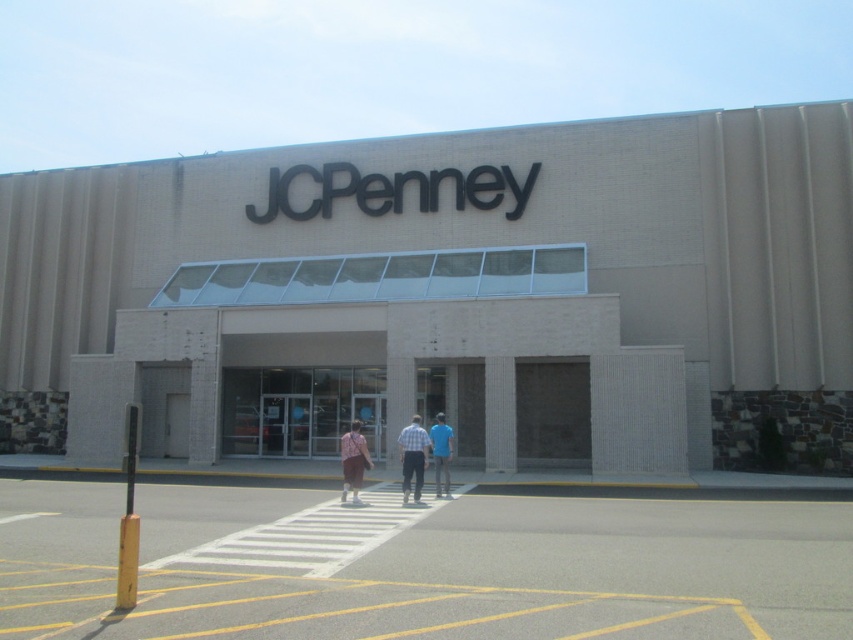
Does white brick storefront at center have a larger size compared to blue cotton shirt at center?

Yes.

Identify the location of white brick storefront at center. (393, 348).

Find the location of a particular element. white brick storefront at center is located at coordinates (393, 348).

Which is behind, point (656, 364) or point (419, 420)?

The point (656, 364) is behind.

Where is `white brick storefront at center`? Image resolution: width=853 pixels, height=640 pixels. white brick storefront at center is located at coordinates (393, 348).

The height and width of the screenshot is (640, 853). What are the coordinates of `white brick storefront at center` in the screenshot? It's located at (393, 348).

What do you see at coordinates (445, 294) in the screenshot?
I see `beige brick mall at center` at bounding box center [445, 294].

Where is `beige brick mall at center`? The width and height of the screenshot is (853, 640). beige brick mall at center is located at coordinates (445, 294).